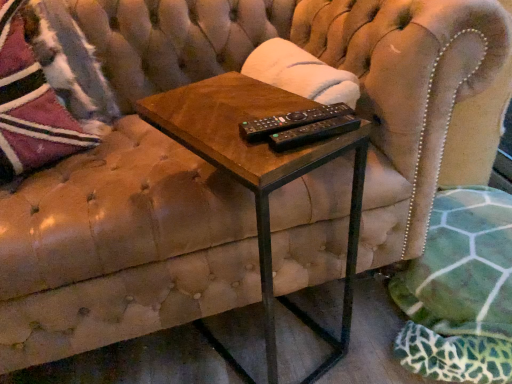
What do you see at coordinates (262, 172) in the screenshot?
I see `woodenmaterial/texturetable at center` at bounding box center [262, 172].

What do you see at coordinates (290, 121) in the screenshot? I see `black plastic remote controls at center` at bounding box center [290, 121].

Describe the element at coordinates (460, 291) in the screenshot. This screenshot has height=384, width=512. I see `green fabric swivel chair at lower right` at that location.

What do you see at coordinates (313, 132) in the screenshot? I see `black plastic remote at center` at bounding box center [313, 132].

The image size is (512, 384). In order to click on woodenmaterial/texturetable at center in this screenshot , I will do `click(262, 172)`.

Can you tell me how much black plastic remote controls at center and black plastic remote at center differ in facing direction?

7.26 degrees.

Can you confirm if black plastic remote controls at center is smaller than black plastic remote at center?

Incorrect, black plastic remote controls at center is not smaller in size than black plastic remote at center.

From a real-world perspective, who is located higher, black plastic remote controls at center or black plastic remote at center?

black plastic remote at center.

From a real-world perspective, is green fabric swivel chair at lower right physically below black plastic remote controls at center?

Yes.

Considering the sizes of objects green fabric swivel chair at lower right and black plastic remote controls at center in the image provided, who is taller, green fabric swivel chair at lower right or black plastic remote controls at center?

green fabric swivel chair at lower right is taller.

What's the angular difference between green fabric swivel chair at lower right and black plastic remote controls at center's facing directions?

The angle between the facing direction of green fabric swivel chair at lower right and the facing direction of black plastic remote controls at center is 80.6 degrees.

Can you confirm if green fabric swivel chair at lower right is thinner than black plastic remote controls at center?

Incorrect, the width of green fabric swivel chair at lower right is not less than that of black plastic remote controls at center.

From the picture: Between velvet textured throw pillow at upper left and green fabric swivel chair at lower right, which one has more height?

With more height is velvet textured throw pillow at upper left.

In the image, is velvet textured throw pillow at upper left positioned in front of or behind green fabric swivel chair at lower right?

Clearly, velvet textured throw pillow at upper left is behind green fabric swivel chair at lower right.

From the picture: How different are the orientations of velvet textured throw pillow at upper left and green fabric swivel chair at lower right in degrees?

velvet textured throw pillow at upper left and green fabric swivel chair at lower right are facing 8.19 degrees away from each other.

Does point (2, 31) lie in front of point (462, 203)?

Yes, it is.

Is there a large distance between woodenmaterial/texturetable at center and velvet textured throw pillow at upper left?

Actually, woodenmaterial/texturetable at center and velvet textured throw pillow at upper left are a little close together.

Does woodenmaterial/texturetable at center come in front of velvet textured throw pillow at upper left?

Yes, woodenmaterial/texturetable at center is closer to the viewer.

Which object is positioned more to the right, woodenmaterial/texturetable at center or velvet textured throw pillow at upper left?

woodenmaterial/texturetable at center.

Is black plastic remote controls at center at the back of velvet textured throw pillow at upper left?

No, velvet textured throw pillow at upper left's orientation is not away from black plastic remote controls at center.

In the scene shown: Is velvet textured throw pillow at upper left positioned far away from black plastic remote controls at center?

velvet textured throw pillow at upper left is near black plastic remote controls at center, not far away.

How distant is velvet textured throw pillow at upper left from black plastic remote controls at center?

velvet textured throw pillow at upper left is 24.01 inches away from black plastic remote controls at center.

From their relative heights in the image, would you say velvet textured throw pillow at upper left is taller or shorter than black plastic remote controls at center?

velvet textured throw pillow at upper left is taller than black plastic remote controls at center.

Which object is further away from the camera, black plastic remote controls at center or velvet textured throw pillow at upper left?

velvet textured throw pillow at upper left is behind.

Does black plastic remote controls at center have a greater width compared to velvet textured throw pillow at upper left?

No, black plastic remote controls at center is not wider than velvet textured throw pillow at upper left.

Is point (308, 111) less distant than point (31, 161)?

Yes, it is.

Is black plastic remote controls at center far from velvet textured throw pillow at upper left?

That's not correct — black plastic remote controls at center is a little close to velvet textured throw pillow at upper left.

How different are the orientations of woodenmaterial/texturetable at center and green fabric swivel chair at lower right in degrees?

153 degrees separate the facing orientations of woodenmaterial/texturetable at center and green fabric swivel chair at lower right.

Is woodenmaterial/texturetable at center at the left side of green fabric swivel chair at lower right?

Correct, you'll find woodenmaterial/texturetable at center to the left of green fabric swivel chair at lower right.

Which object is further away from the camera, woodenmaterial/texturetable at center or green fabric swivel chair at lower right?

green fabric swivel chair at lower right.

From a real-world perspective, does woodenmaterial/texturetable at center sit lower than green fabric swivel chair at lower right?

Actually, woodenmaterial/texturetable at center is physically above green fabric swivel chair at lower right in the real world.

Locate an element on the screen. The height and width of the screenshot is (384, 512). remote located on the right of black plastic remote controls at center is located at coordinates (313, 132).

Find the location of `control in front of the green fabric swivel chair at lower right`. control in front of the green fabric swivel chair at lower right is located at coordinates (290, 121).

Estimate the real-world distances between objects in this image. Which object is further from black plastic remote at center, velvet textured throw pillow at upper left or green fabric swivel chair at lower right?

Based on the image, green fabric swivel chair at lower right appears to be further to black plastic remote at center.

Estimate the real-world distances between objects in this image. Which object is closer to woodenmaterial/texturetable at center, black plastic remote at center or black plastic remote controls at center?

black plastic remote controls at center.

Estimate the real-world distances between objects in this image. Which object is closer to green fabric swivel chair at lower right, woodenmaterial/texturetable at center or velvet textured throw pillow at upper left?

Based on the image, woodenmaterial/texturetable at center appears to be nearer to green fabric swivel chair at lower right.

When comparing their distances from woodenmaterial/texturetable at center, does black plastic remote controls at center or velvet textured throw pillow at upper left seem further?

velvet textured throw pillow at upper left is further to woodenmaterial/texturetable at center.

Estimate the real-world distances between objects in this image. Which object is closer to black plastic remote at center, black plastic remote controls at center or green fabric swivel chair at lower right?

The object closer to black plastic remote at center is black plastic remote controls at center.

Considering their positions, is velvet textured throw pillow at upper left positioned closer to green fabric swivel chair at lower right than black plastic remote at center?

Based on the image, black plastic remote at center appears to be nearer to green fabric swivel chair at lower right.

Which object lies further to the anchor point velvet textured throw pillow at upper left, black plastic remote at center or black plastic remote controls at center?

black plastic remote at center is positioned further to the anchor velvet textured throw pillow at upper left.

Which object lies nearer to the anchor point velvet textured throw pillow at upper left, woodenmaterial/texturetable at center or black plastic remote controls at center?

Among the two, woodenmaterial/texturetable at center is located nearer to velvet textured throw pillow at upper left.

Where is `table located between velvet textured throw pillow at upper left and green fabric swivel chair at lower right in the left-right direction`? The height and width of the screenshot is (384, 512). table located between velvet textured throw pillow at upper left and green fabric swivel chair at lower right in the left-right direction is located at coordinates (262, 172).

Identify the location of remote situated between velvet textured throw pillow at upper left and green fabric swivel chair at lower right from left to right. (313, 132).

Find the location of a particular element. The width and height of the screenshot is (512, 384). remote between woodenmaterial/texturetable at center and green fabric swivel chair at lower right is located at coordinates (313, 132).

Locate an element on the screen. The width and height of the screenshot is (512, 384). control situated between velvet textured throw pillow at upper left and black plastic remote at center from left to right is located at coordinates (290, 121).